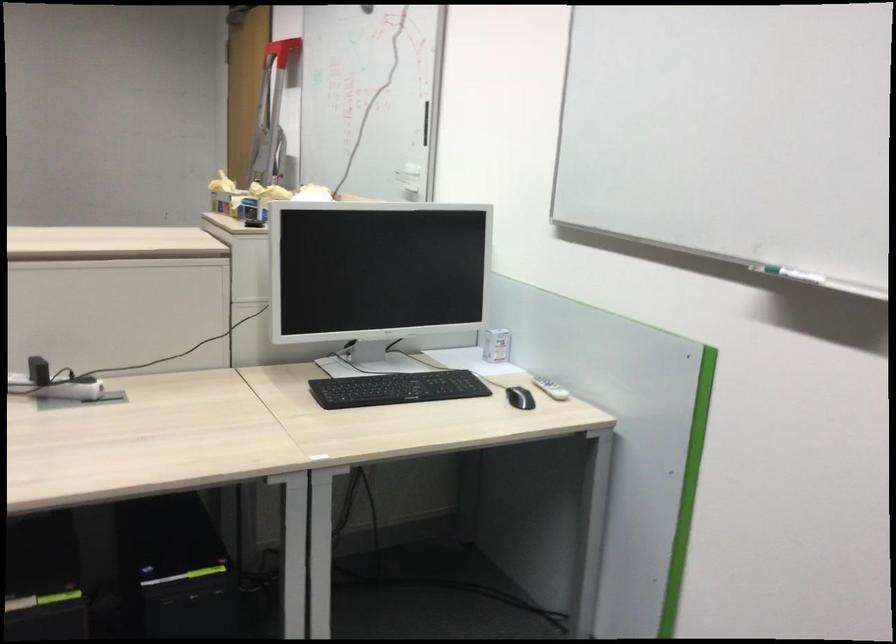
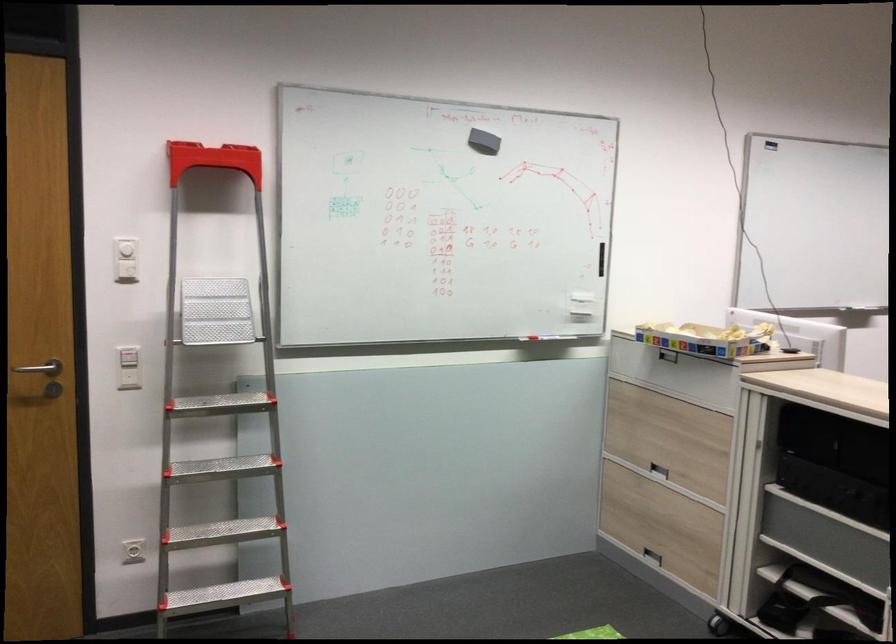
In the second image, find the point that corresponds to the point at 382,200 in the first image.

(539, 337)